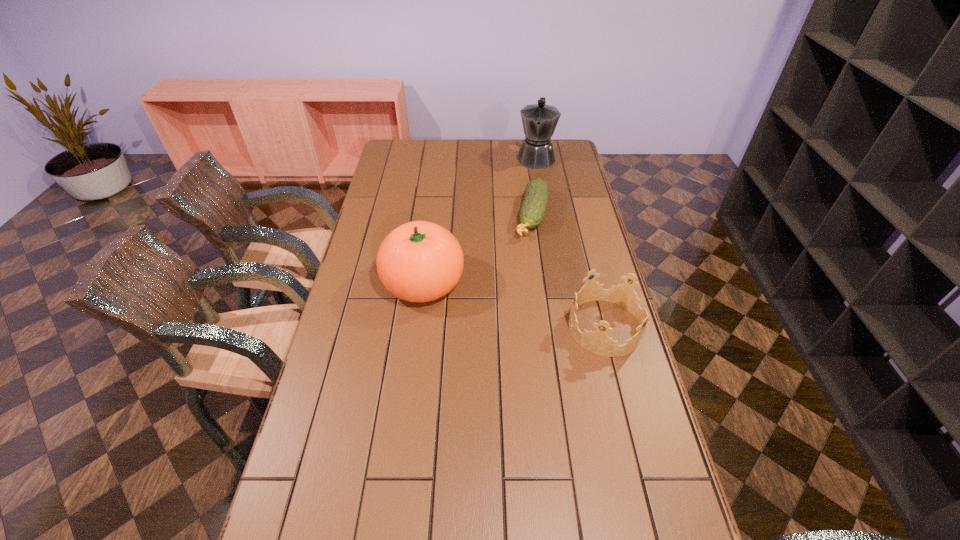
Locate an element on the screen. Image resolution: width=960 pixels, height=540 pixels. the leftmost object is located at coordinates (420, 261).

The image size is (960, 540). Find the location of `pumpkin`. pumpkin is located at coordinates (420, 261).

Where is `tiara`? This screenshot has width=960, height=540. tiara is located at coordinates (598, 342).

The width and height of the screenshot is (960, 540). I want to click on the second farthest object, so click(533, 208).

At what (x,y) coordinates should I click in order to perform the action: click on cucumber. Please return your answer as a coordinate pair (x, y). The height and width of the screenshot is (540, 960). Looking at the image, I should click on (533, 208).

Find the location of a particular element. This screenshot has width=960, height=540. the farthest object is located at coordinates (539, 121).

Find the location of a particular element. vacant space located on the back of the pumpkin is located at coordinates (430, 228).

In order to click on free space located on the front-facing side of the tiara in this screenshot , I will do `click(464, 327)`.

At what (x,y) coordinates should I click in order to perform the action: click on vacant space located on the front-facing side of the tiara. Please return your answer as a coordinate pair (x, y). Looking at the image, I should click on coord(552,327).

Find the location of `free space located on the front-facing side of the tiara`. free space located on the front-facing side of the tiara is located at coordinates [x=507, y=327].